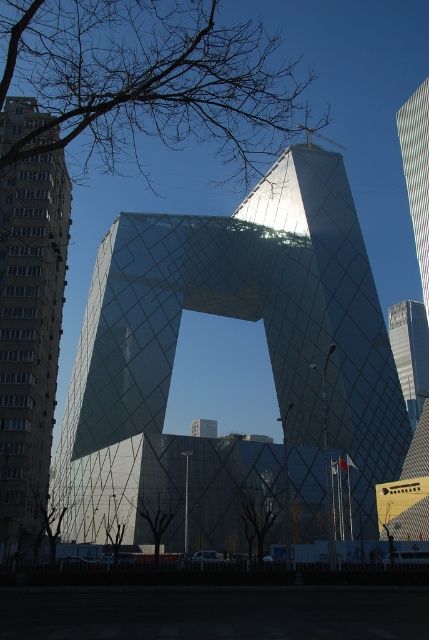
Who is taller, reflective glass tower at center or metallic glass skyscraper at upper right?

metallic glass skyscraper at upper right is taller.

Can you confirm if reflective glass tower at center is positioned to the left of metallic glass skyscraper at upper right?

Indeed, reflective glass tower at center is positioned on the left side of metallic glass skyscraper at upper right.

Is point (154, 486) farther from camera compared to point (416, 202)?

No.

Locate an element on the screen. This screenshot has width=429, height=640. reflective glass tower at center is located at coordinates click(x=268, y=349).

Between reflective glass tower at center and matte glass skyscraper at left, which one has more height?

With more height is matte glass skyscraper at left.

The height and width of the screenshot is (640, 429). What do you see at coordinates (268, 349) in the screenshot? I see `reflective glass tower at center` at bounding box center [268, 349].

Find the location of a particular element. Image resolution: width=429 pixels, height=640 pixels. reflective glass tower at center is located at coordinates (268, 349).

Is matte glass skyscraper at left above metallic glass skyscraper at upper right?

Incorrect, matte glass skyscraper at left is not positioned above metallic glass skyscraper at upper right.

Where is `matte glass skyscraper at left`? The image size is (429, 640). matte glass skyscraper at left is located at coordinates (30, 337).

In order to click on matte glass skyscraper at left in this screenshot , I will do `click(30, 337)`.